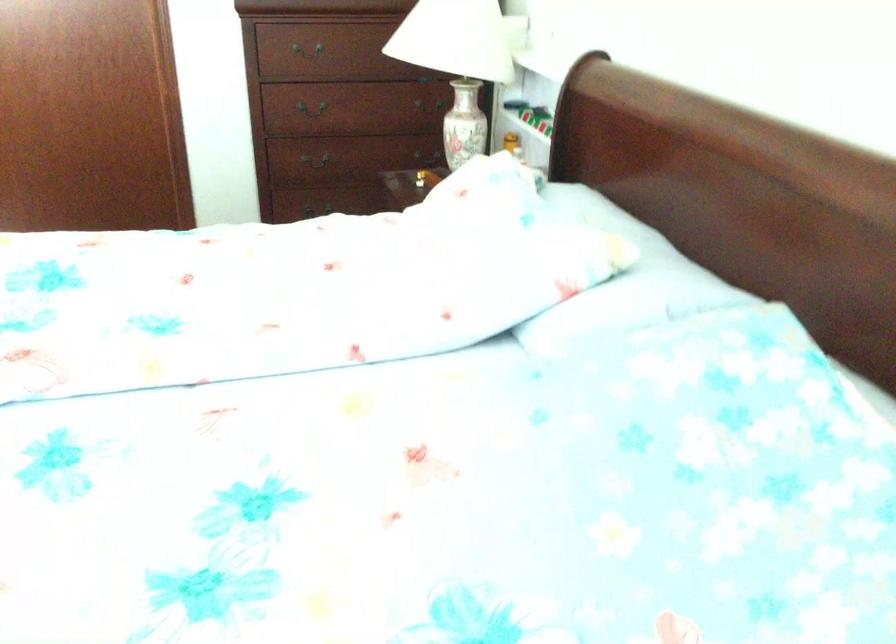
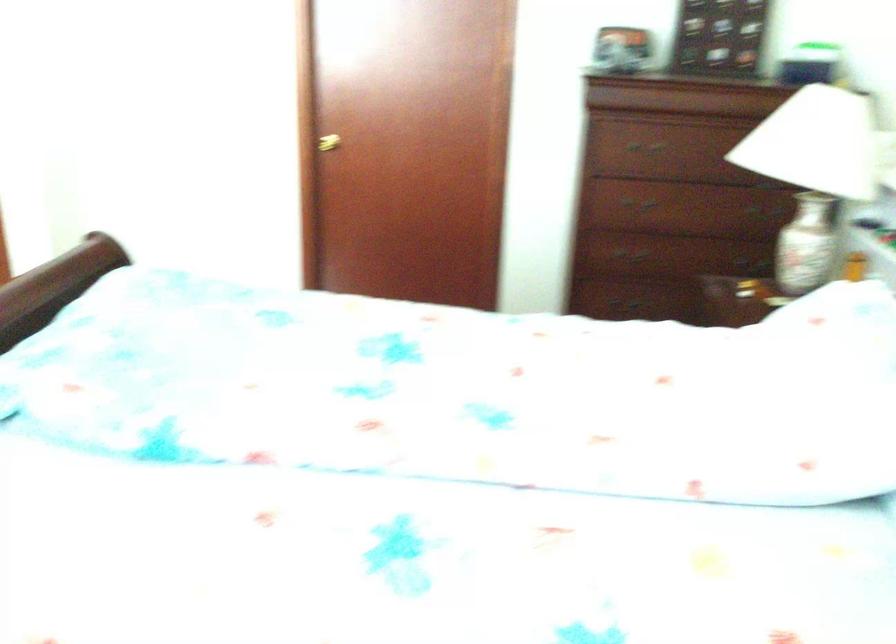
Question: The camera is either moving clockwise (left) or counter-clockwise (right) around the object. The first image is from the beginning of the video and the second image is from the end. Is the camera moving left or right when shooting the video?

Choices:
 (A) Left
 (B) Right

Answer: (B)